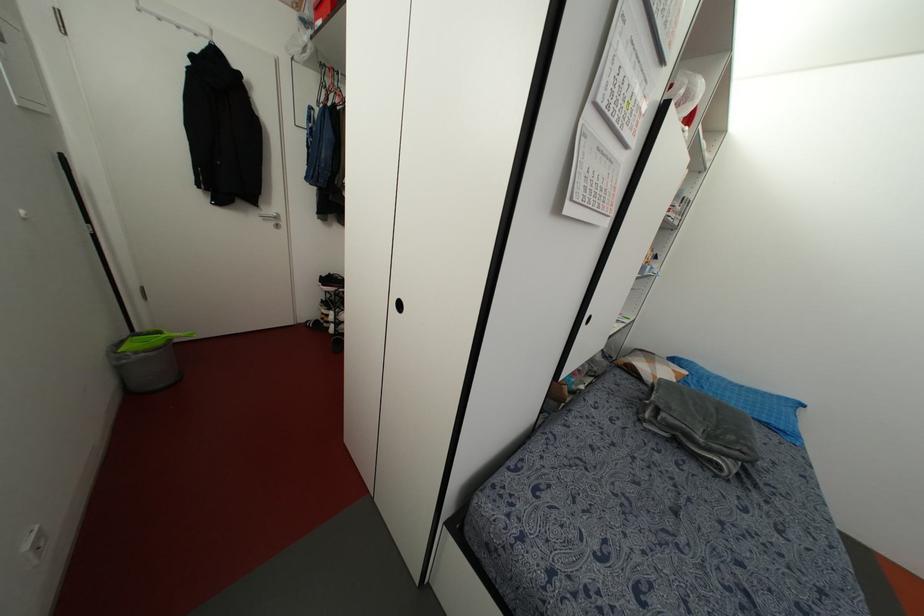
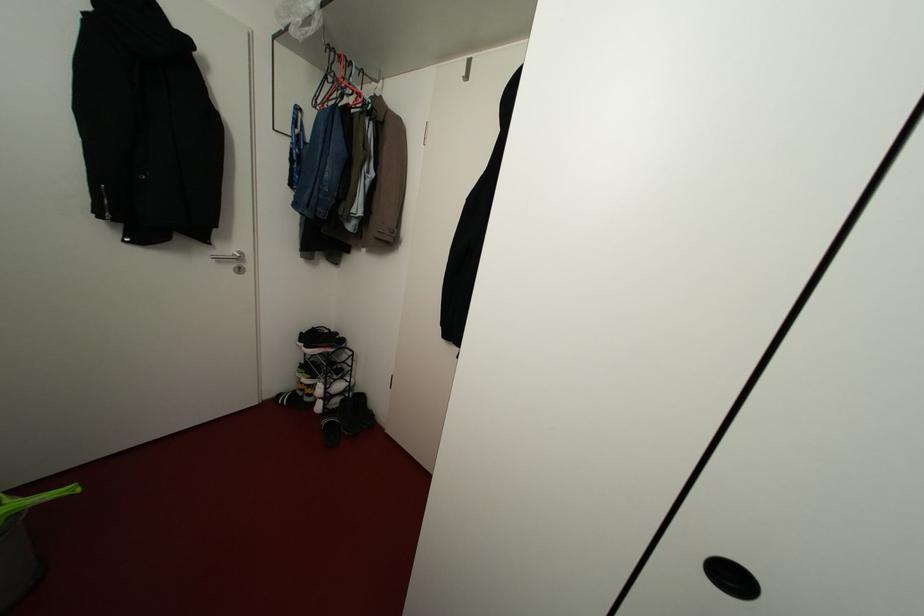
In a continuous first-person perspective shot, in which direction is the camera moving?

The cameraman walked toward left, forward.